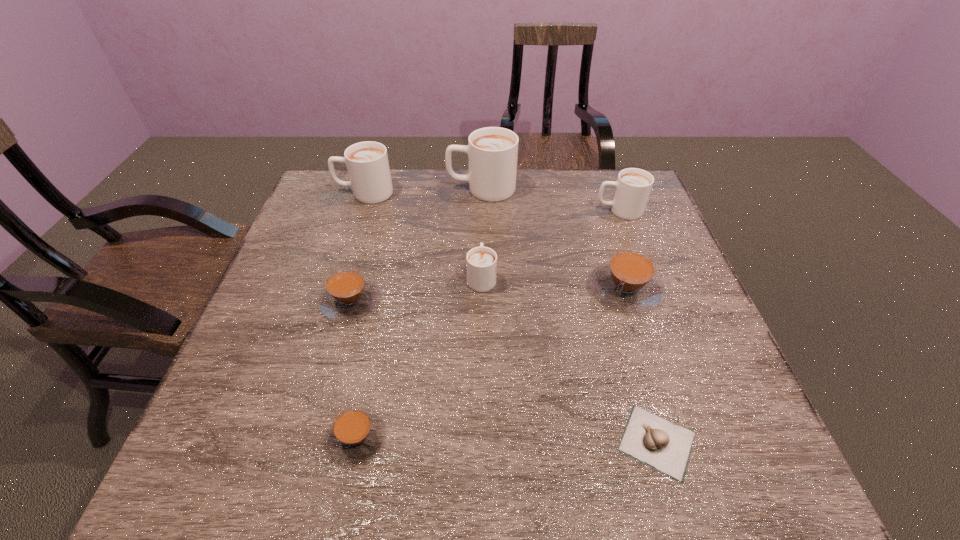
Identify the location of vacant point located between the biggest brown cappuccino and the seventh tallest object. Image resolution: width=960 pixels, height=540 pixels. (492, 363).

Where is `empty space that is in between the smallest brown cappuccino and the rightmost white cappuccino`? The width and height of the screenshot is (960, 540). empty space that is in between the smallest brown cappuccino and the rightmost white cappuccino is located at coordinates (488, 324).

Locate an element on the screen. free point between the fifth shortest cappuccino and the biggest white cappuccino is located at coordinates (550, 199).

This screenshot has width=960, height=540. I want to click on vacant area that lies between the smallest brown cappuccino and the second smallest brown cappuccino, so click(353, 369).

Locate an element on the screen. This screenshot has width=960, height=540. free space between the leftmost white cappuccino and the garlic is located at coordinates (511, 318).

Image resolution: width=960 pixels, height=540 pixels. Find the location of `object that is the seventh closest to the smallest white cappuccino`. object that is the seventh closest to the smallest white cappuccino is located at coordinates (665, 446).

Identify the location of object that is the sixth nearest to the shortest cappuccino. This screenshot has width=960, height=540. (492, 152).

Locate which cappuccino is the third closest to the smallest brown cappuccino. Please provide its 2D coordinates. Your answer should be formatted as a tuple, i.e. [(x, y)], where the tuple contains the x and y coordinates of a point satisfying the conditions above.

[(628, 281)]

Locate which cappuccino is the sixth closest to the second smallest brown cappuccino. Please provide its 2D coordinates. Your answer should be formatted as a tuple, i.e. [(x, y)], where the tuple contains the x and y coordinates of a point satisfying the conditions above.

[(633, 186)]

Find the location of a particular element. This screenshot has height=540, width=960. the third closest white cappuccino to the third smallest white cappuccino is located at coordinates (633, 186).